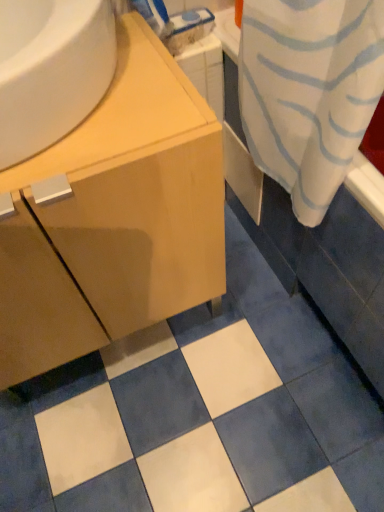
Where is `wooden counter at upper left`? This screenshot has height=512, width=384. wooden counter at upper left is located at coordinates (123, 111).

In order to face wooden counter at upper left, should I rotate leftwards or rightwards?

A 19.019 degree turn to the left will do.

What is the approximate height of wooden counter at upper left?

6.00 inches.

What do you see at coordinates (123, 111) in the screenshot? The width and height of the screenshot is (384, 512). I see `wooden counter at upper left` at bounding box center [123, 111].

Measure the distance between point (176, 245) and camera.

The depth of point (176, 245) is 81.60 centimeters.

What do you see at coordinates (113, 217) in the screenshot? Image resolution: width=384 pixels, height=512 pixels. I see `light wood cabinet at center` at bounding box center [113, 217].

You are a GUI agent. You are given a task and a screenshot of the screen. Output one action in this format:
    pyautogui.click(x=<x>, y=<y>)
    Task: Click on the light wood cabinet at center
    Image resolution: width=384 pixels, height=512 pixels.
    Given the screenshot: What is the action you would take?
    pyautogui.click(x=113, y=217)

Where is `wooden counter at upper left`? This screenshot has width=384, height=512. wooden counter at upper left is located at coordinates (123, 111).

Is wooden counter at upper left to the left or to the right of light wood cabinet at center in the image?

In the image, wooden counter at upper left appears on the right side of light wood cabinet at center.

Considering their positions, is wooden counter at upper left located in front of or behind light wood cabinet at center?

Clearly, wooden counter at upper left is in front of light wood cabinet at center.

Does point (193, 92) lie in front of point (17, 192)?

No, (193, 92) is further to viewer.

From the image's perspective, would you say wooden counter at upper left is positioned over light wood cabinet at center?

Yes.

From a real-world perspective, is wooden counter at upper left physically located above or below light wood cabinet at center?

wooden counter at upper left is situated higher than light wood cabinet at center in the real world.

Does wooden counter at upper left have a greater width compared to light wood cabinet at center?

In fact, wooden counter at upper left might be narrower than light wood cabinet at center.

In terms of height, does wooden counter at upper left look taller or shorter compared to light wood cabinet at center?

In the image, wooden counter at upper left appears to be shorter than light wood cabinet at center.

Based on their sizes in the image, would you say wooden counter at upper left is bigger or smaller than light wood cabinet at center?

In the image, wooden counter at upper left appears to be smaller than light wood cabinet at center.

Is wooden counter at upper left situated inside light wood cabinet at center or outside?

wooden counter at upper left is located beyond the bounds of light wood cabinet at center.

Is wooden counter at upper left not close to light wood cabinet at center?

No, wooden counter at upper left is not far from light wood cabinet at center.

Could you tell me if wooden counter at upper left is turned towards light wood cabinet at center?

No.

What's the angular difference between wooden counter at upper left and light wood cabinet at center's facing directions?

The angle between the facing direction of wooden counter at upper left and the facing direction of light wood cabinet at center is 0.926 degrees.

How distant is wooden counter at upper left from light wood cabinet at center?

They are 6.08 inches apart.

At what (x,y) coordinates should I click in order to perform the action: click on bathroom cabinet located behind the wooden counter at upper left. Please return your answer as a coordinate pair (x, y). The width and height of the screenshot is (384, 512). Looking at the image, I should click on (113, 217).

Does light wood cabinet at center appear on the right side of wooden counter at upper left?

In fact, light wood cabinet at center is to the left of wooden counter at upper left.

Relative to wooden counter at upper left, is light wood cabinet at center in front or behind?

light wood cabinet at center is behind wooden counter at upper left.

Considering the points (22, 366) and (135, 62), which point is behind, point (22, 366) or point (135, 62)?

Positioned behind is point (22, 366).

From the image's perspective, is light wood cabinet at center beneath wooden counter at upper left?

Indeed, from the image's perspective, light wood cabinet at center is shown beneath wooden counter at upper left.

From a real-world perspective, is light wood cabinet at center positioned above or below wooden counter at upper left?

light wood cabinet at center is below wooden counter at upper left.

Is light wood cabinet at center wider or thinner than wooden counter at upper left?

In the image, light wood cabinet at center appears to be wider than wooden counter at upper left.

Who is shorter, light wood cabinet at center or wooden counter at upper left?

wooden counter at upper left.

Can you confirm if light wood cabinet at center is bigger than wooden counter at upper left?

Correct, light wood cabinet at center is larger in size than wooden counter at upper left.

Can we say light wood cabinet at center lies outside wooden counter at upper left?

light wood cabinet at center lies outside wooden counter at upper left's area.

Is light wood cabinet at center far away from wooden counter at upper left?

light wood cabinet at center is actually quite close to wooden counter at upper left.

In the scene shown: Could you tell me if light wood cabinet at center is turned towards wooden counter at upper left?

No, light wood cabinet at center is not aimed at wooden counter at upper left.

How distant is light wood cabinet at center from wooden counter at upper left?

6.08 inches.

The image size is (384, 512). I want to click on bathroom cabinet below the wooden counter at upper left (from the image's perspective), so click(113, 217).

Where is `counter top positioned vertically above the light wood cabinet at center (from a real-world perspective)`? counter top positioned vertically above the light wood cabinet at center (from a real-world perspective) is located at coordinates (123, 111).

Where is `bathroom cabinet below the wooden counter at upper left (from a real-world perspective)`? The height and width of the screenshot is (512, 384). bathroom cabinet below the wooden counter at upper left (from a real-world perspective) is located at coordinates (113, 217).